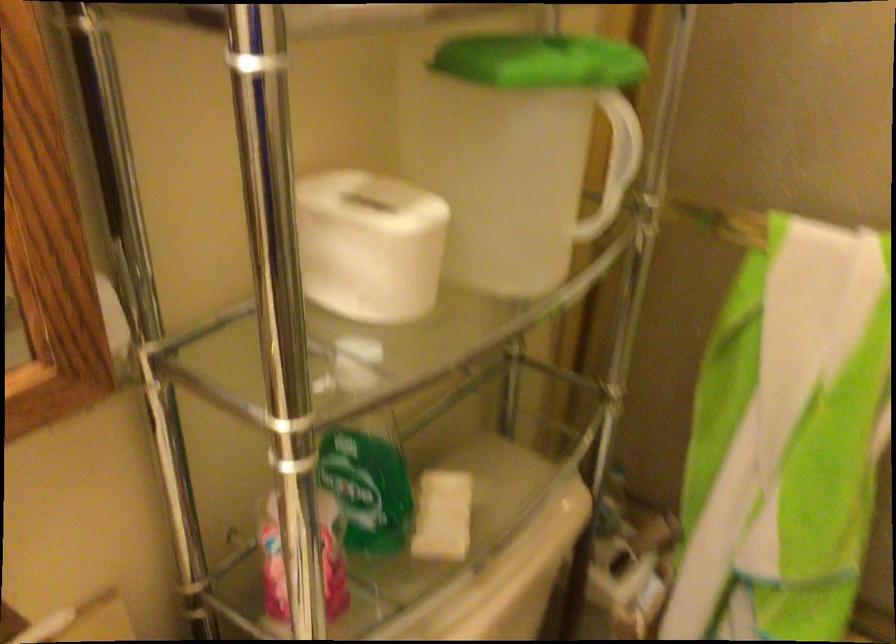
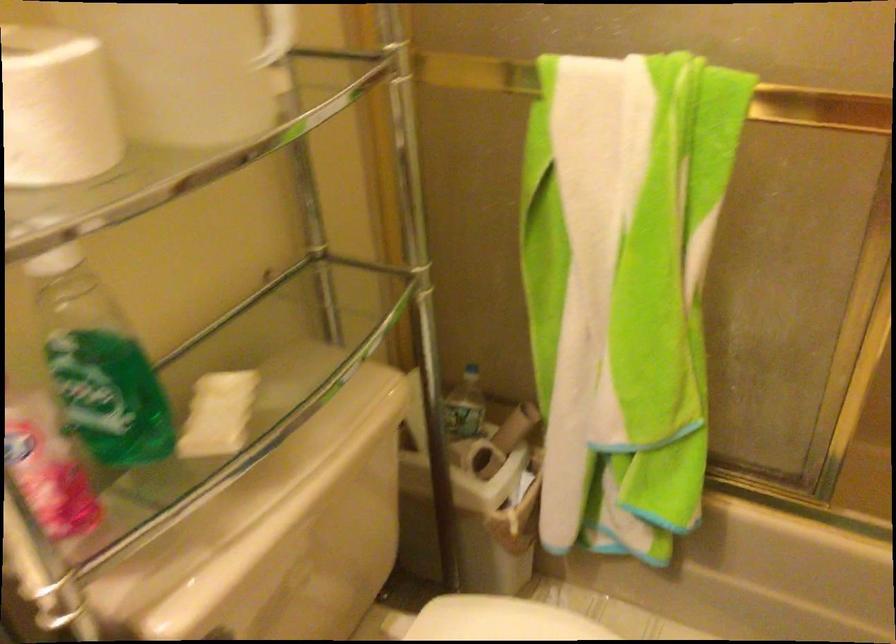
Find the pixel in the second image that matches pixel 543 198 in the first image.

(270, 64)